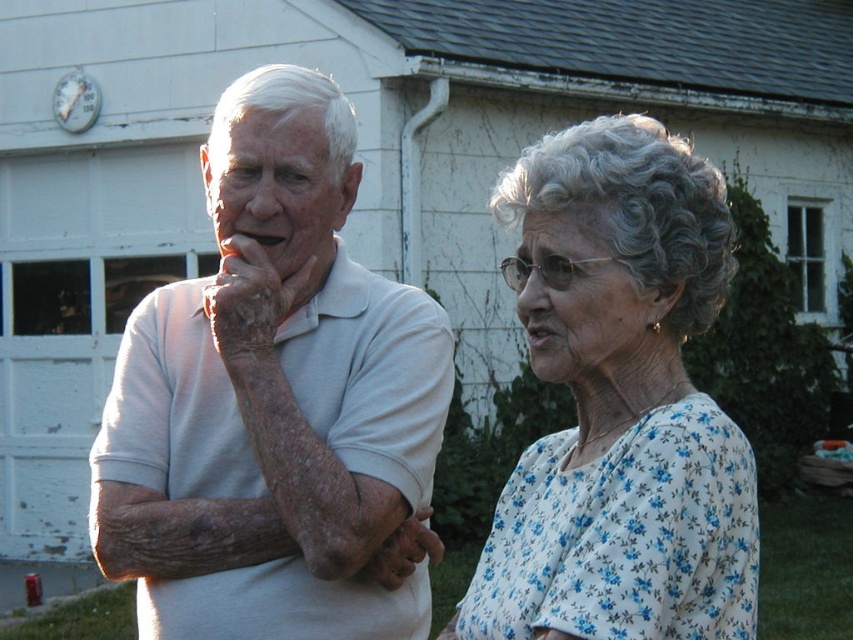
Can you confirm if white matte shirt at center is positioned below white floral blouse at center?

Incorrect, white matte shirt at center is not positioned below white floral blouse at center.

Does white matte shirt at center come in front of white floral blouse at center?

That is False.

Does point (337, 108) come behind point (498, 608)?

That is True.

Locate an element on the screen. white matte shirt at center is located at coordinates (271, 400).

Who is shorter, white matte shirt at center or dry skin hand at center?

Standing shorter between the two is dry skin hand at center.

Does white matte shirt at center have a greater width compared to dry skin hand at center?

Yes, white matte shirt at center is wider than dry skin hand at center.

Is point (141, 577) closer to viewer compared to point (378, 579)?

No, (141, 577) is further to viewer.

The width and height of the screenshot is (853, 640). What are the coordinates of `white matte shirt at center` in the screenshot? It's located at (271, 400).

Can you confirm if dry skin at left is shorter than dry skin hand at center?

No, dry skin at left is not shorter than dry skin hand at center.

Which is below, dry skin at left or dry skin hand at center?

Positioned lower is dry skin hand at center.

Who is more distant from viewer, (262, 268) or (392, 588)?

Positioned behind is point (392, 588).

Identify the location of dry skin at left. The image size is (853, 640). (250, 298).